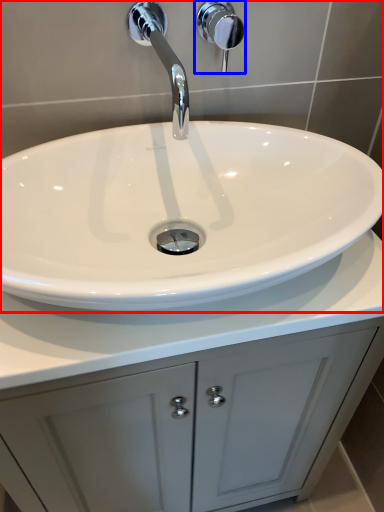
Question: Which point is closer to the camera, sink (highlighted by a red box) or shower (highlighted by a blue box)?

Choices:
 (A) sink
 (B) shower

Answer: (A)